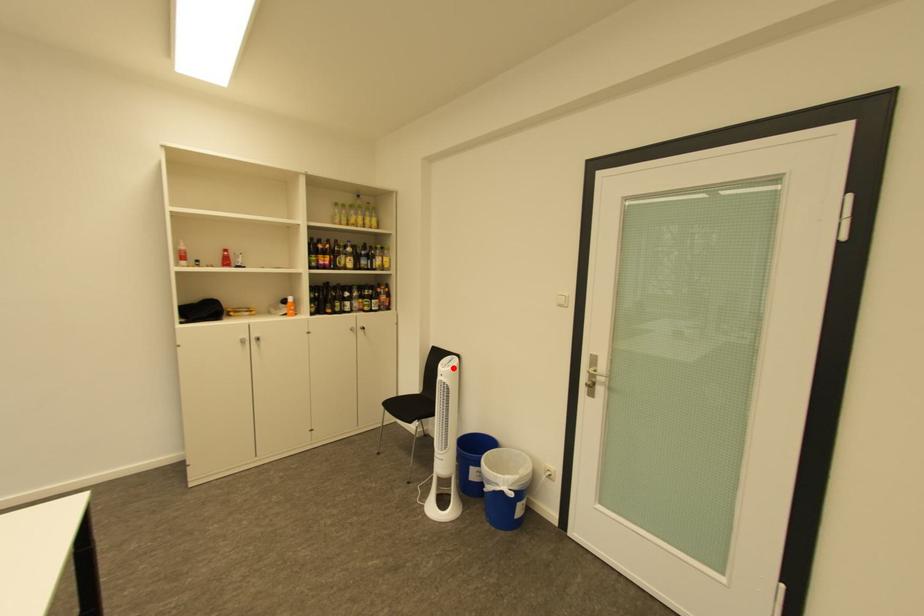
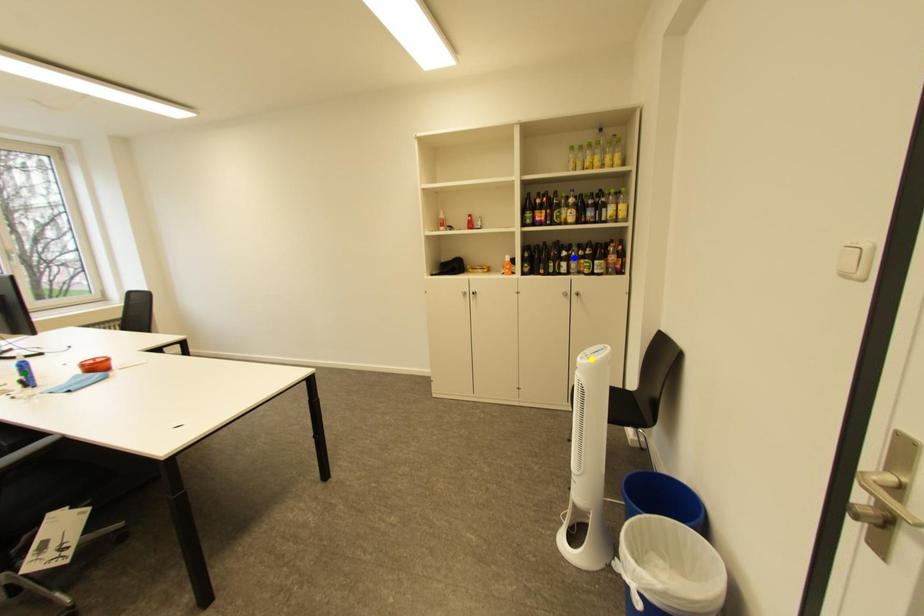
Question: I am providing you with two images of the same scene from different viewpoints. A red point is marked on the first image. You are given multiple points on the second image. In image 2, which mark is for the same physical point as the one in image 1?

Choices:
 (A) blue point
 (B) yellow point
 (C) green point

Answer: (B)